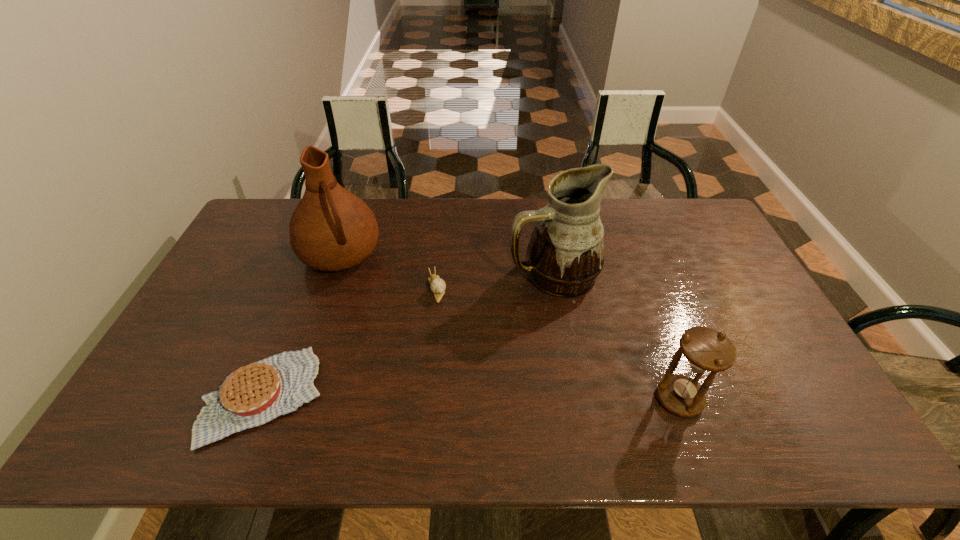
Image resolution: width=960 pixels, height=540 pixels. I want to click on vacant point located 0.120m on the shell of the third object from right to left, so click(x=450, y=333).

This screenshot has width=960, height=540. In order to click on free spot located on the side of the left pitcher with the handle in this screenshot , I will do `click(362, 299)`.

Find the location of a particular element. vacant space situated on the side of the left pitcher with the handle is located at coordinates (372, 322).

The image size is (960, 540). Identify the location of vacant space situated 0.120m on the side of the left pitcher with the handle. (365, 306).

In order to click on free point located 0.120m from the spout of the right pitcher in this screenshot , I will do `click(510, 323)`.

The height and width of the screenshot is (540, 960). I want to click on free region located from the spout of the right pitcher, so click(x=514, y=319).

This screenshot has height=540, width=960. I want to click on free space located 0.180m from the spout of the right pitcher, so click(498, 338).

The image size is (960, 540). Identify the location of object that is at the far edge. (331, 229).

Find the location of a particular element. The height and width of the screenshot is (540, 960). pie positioned at the near edge is located at coordinates (252, 395).

Image resolution: width=960 pixels, height=540 pixels. In order to click on hourglass located in the near edge section of the desktop in this screenshot , I will do `click(705, 349)`.